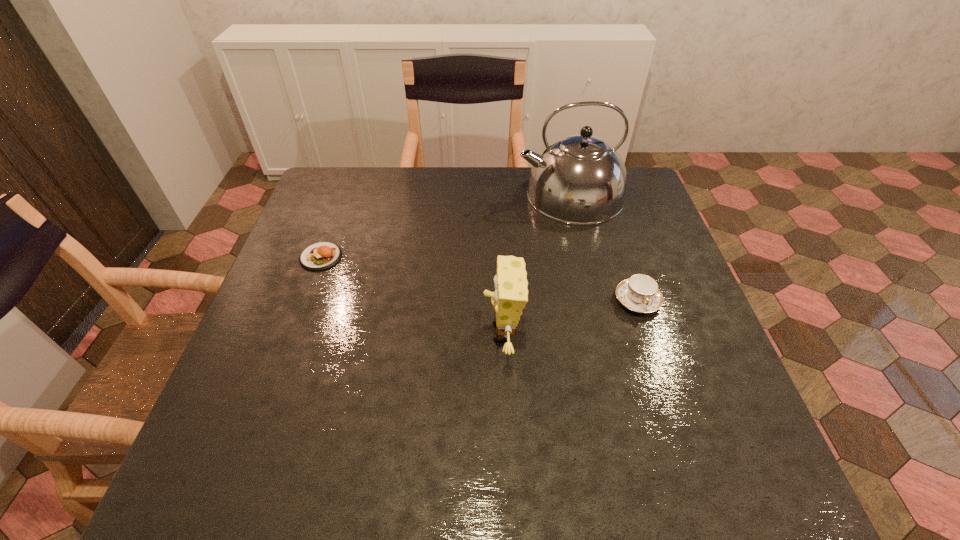
Where is `vacant area situated on the face of the third object from right to left`? This screenshot has width=960, height=540. vacant area situated on the face of the third object from right to left is located at coordinates (425, 332).

Find the location of a particular element. The height and width of the screenshot is (540, 960). vacant point located 0.370m on the face of the third object from right to left is located at coordinates (319, 332).

This screenshot has height=540, width=960. Find the location of `vacant area located on the face of the third object from right to left`. vacant area located on the face of the third object from right to left is located at coordinates (314, 332).

At what (x,y) coordinates should I click in order to perform the action: click on free space located on the side with the handle of the teacup. Please return your answer as a coordinate pair (x, y). Looking at the image, I should click on (658, 363).

At what (x,y) coordinates should I click in order to perform the action: click on vacant space located 0.230m on the right of the leftmost object. Please return your answer as a coordinate pair (x, y). The width and height of the screenshot is (960, 540). Looking at the image, I should click on (429, 257).

Where is `object present at the far edge`? The image size is (960, 540). object present at the far edge is located at coordinates [580, 179].

The width and height of the screenshot is (960, 540). Identify the location of object that is at the left edge. pyautogui.click(x=319, y=256).

Locate an element on the screen. The height and width of the screenshot is (540, 960). kettle that is positioned at the right edge is located at coordinates (580, 179).

Identify the location of teacup present at the right edge. (640, 293).

This screenshot has width=960, height=540. In order to click on object present at the far right corner in this screenshot , I will do `click(580, 179)`.